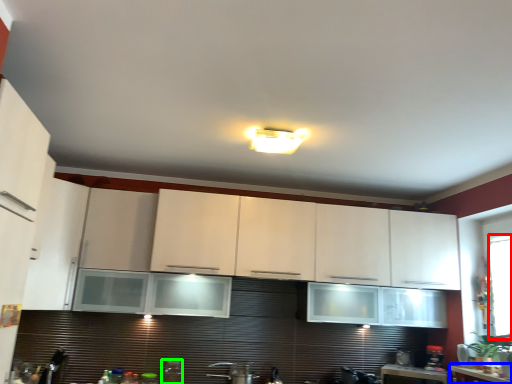
Question: Estimate the real-world distances between objects in this image. Which object is closer to window screen (highlighted by a red box), counter top (highlighted by a blue box) or appliance (highlighted by a green box)?

Choices:
 (A) counter top
 (B) appliance

Answer: (A)